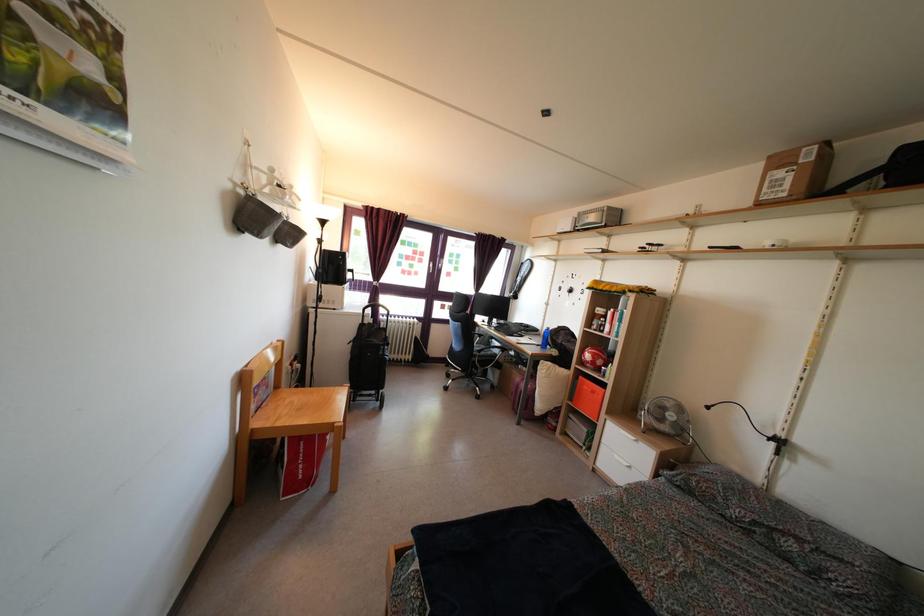
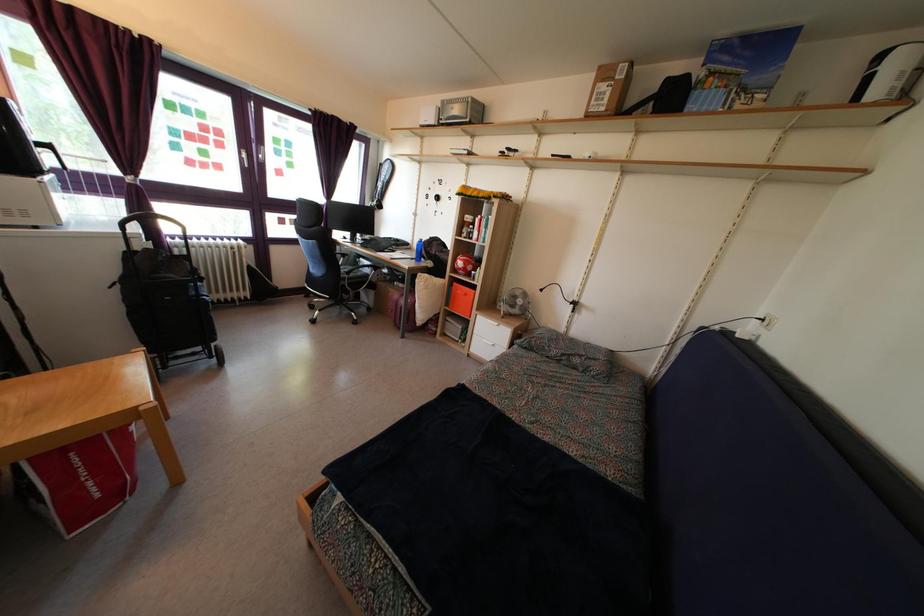
The point at [590,365] is marked in the first image. Where is the corresponding point in the second image?

(463, 272)